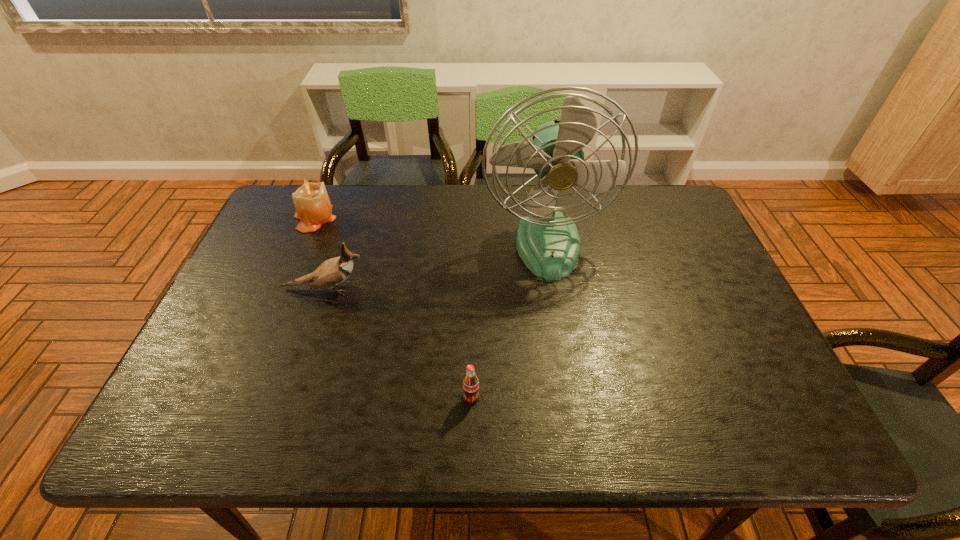
Identify the location of fan present at the far edge. (548, 242).

I want to click on candle located at the far edge, so click(x=313, y=207).

You are a GUI agent. You are given a task and a screenshot of the screen. Output one action in this format:
    pyautogui.click(x=<x>, y=<y>)
    Task: Click on the bird that is at the left edge
    
    Given the screenshot: What is the action you would take?
    pyautogui.click(x=333, y=271)

At what (x,y) coordinates should I click in order to perform the action: click on candle situated at the left edge. Please return your answer as a coordinate pair (x, y). The width and height of the screenshot is (960, 540). Looking at the image, I should click on (313, 207).

The height and width of the screenshot is (540, 960). Identify the location of object that is at the far left corner. (x=313, y=207).

The height and width of the screenshot is (540, 960). I want to click on vacant space at the far edge, so click(x=589, y=227).

Identify the location of free spot at the near edge of the desktop. This screenshot has height=540, width=960. (714, 410).

Locate an element on the screen. The height and width of the screenshot is (540, 960). free space at the left edge of the desktop is located at coordinates (294, 239).

At what (x,y) coordinates should I click in order to perform the action: click on vacant space at the right edge of the desktop. Please return your answer as a coordinate pair (x, y). The height and width of the screenshot is (540, 960). Looking at the image, I should click on (672, 250).

In the image, there is a desktop. Where is `vacant space at the far left corner`? vacant space at the far left corner is located at coordinates (277, 198).